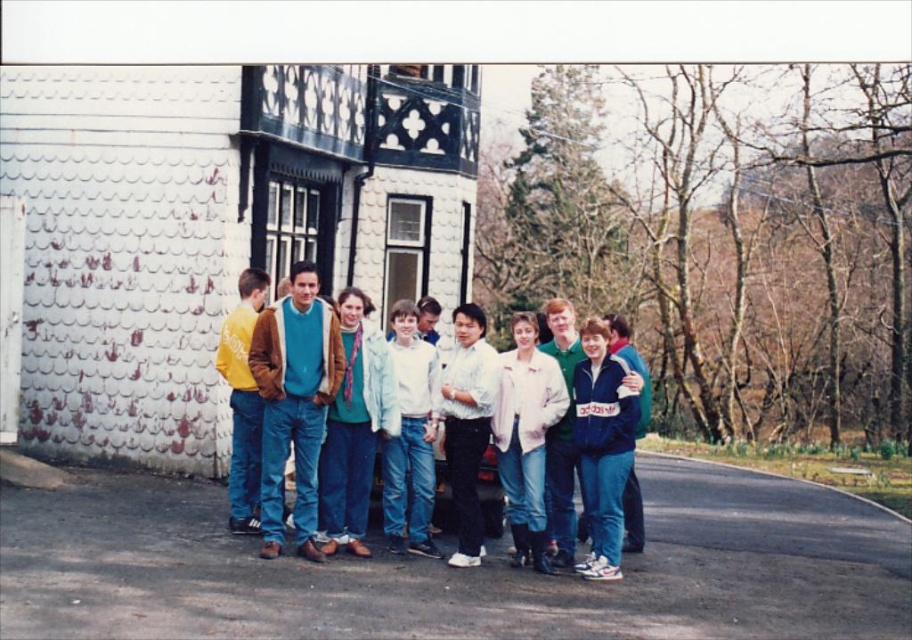
You are a photographer trying to capture a group photo of the matte brown jacket at center and the yellow matte jacket at left. Since you want to ensure both jackets are clearly visible in the frame, which jacket should you focus on first to account for their sizes?

The matte brown jacket at center is larger in width than the yellow matte jacket at left, so you should focus on the matte brown jacket at center first to ensure it fits well in the frame before adjusting for the smaller yellow matte jacket at left.

You are standing in front of the building with the scalloped exterior wall and need to walk to the point that is closer to you. Which point should you head towards, point (x=261, y=323) or point (x=245, y=460)?

You should head towards point (x=261, y=323) because it is closer to the viewer than point (x=245, y=460).

You are a photographer trying to capture a group photo of the people in front of the building. You want to ensure that both the white matte jacket at center and the yellow matte jacket at left are clearly visible in the frame. Based on their positions, which jacket should you focus on first to include both in the shot?

The white matte jacket at center is to the right of the yellow matte jacket at left. Therefore, focusing on the yellow matte jacket at left first will ensure both jackets are included in the frame since the white one is positioned to its right.